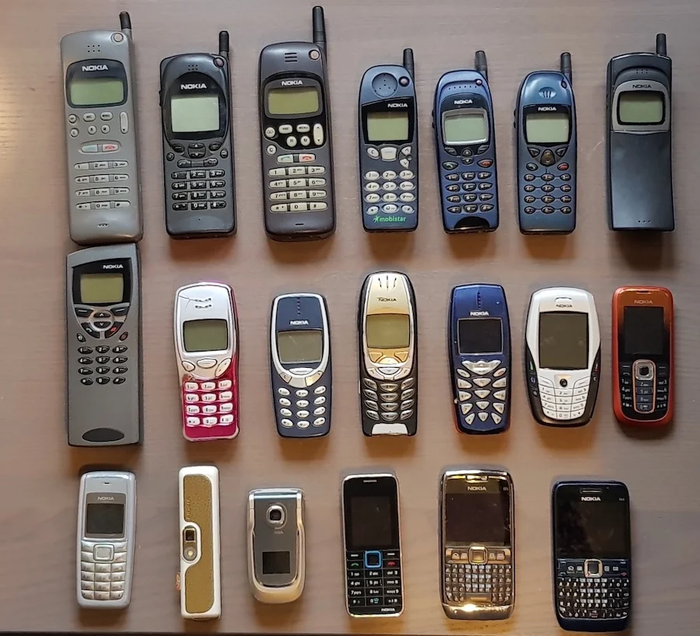
Image resolution: width=700 pixels, height=636 pixels. In order to click on telephones in second row in this screenshot , I will do `click(656, 346)`, `click(558, 376)`, `click(477, 387)`, `click(381, 406)`, `click(302, 411)`, `click(192, 408)`, `click(80, 370)`.